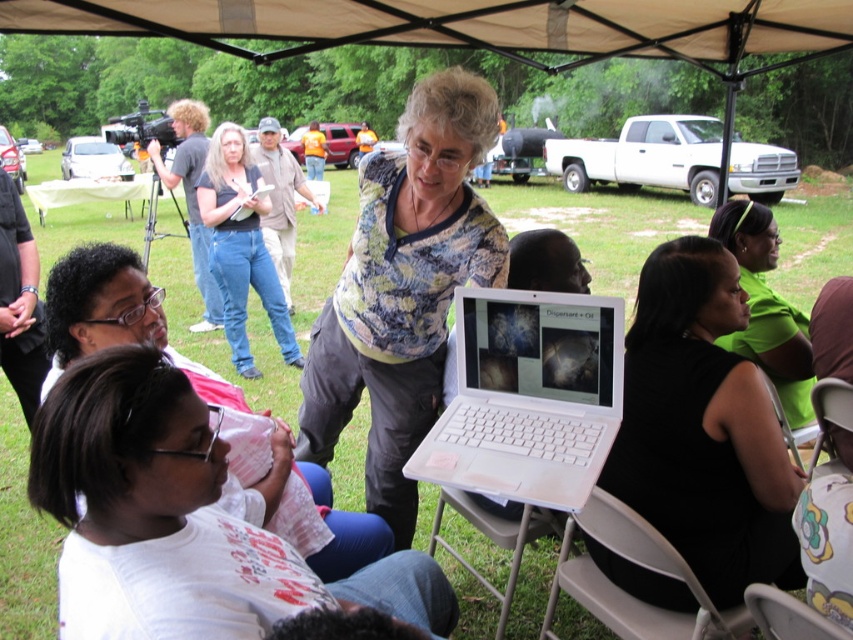
You are a presenter standing behind the white plastic laptop at center. You need to move to the gray plastic chair at lower center to adjust its position. Can you reach the chair without stepping away from the laptop?

The white plastic laptop at center and gray plastic chair at lower center are 27.40 inches apart. Since the distance is more than typical arm length, you would need to step forward to reach the chair.

You are attending an outdoor presentation under a beige canopy tent. You see a white plastic laptop at center and a gray plastic chair at lower center. Which object is nearer to you?

The white plastic laptop at center is closer to the viewer than the gray plastic chair at lower center.

You are attending an outdoor event under a tan fabric canopy at upper center. If you want to move to the area where the presentation is happening, which direction should you walk relative to the canopy?

The tan fabric canopy at upper center is located at point (x=468, y=26), so you should walk downward from the canopy to reach the presentation area.